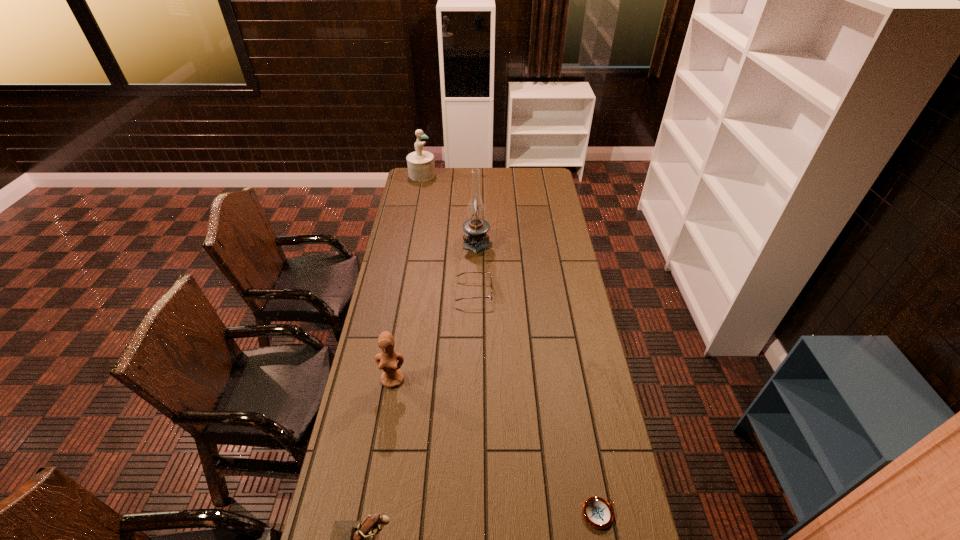
Locate an element on the screen. vacant space located at the beak of the farthest object is located at coordinates (468, 174).

Locate an element on the screen. This screenshot has height=540, width=960. blank space located on the front-facing side of the second farthest figurine is located at coordinates (387, 417).

Image resolution: width=960 pixels, height=540 pixels. In order to click on vacant space situated on the front-facing side of the fifth tallest object in this screenshot , I will do `click(537, 292)`.

I want to click on blank area located on the left of the rightmost object, so click(x=446, y=514).

Locate an element on the screen. This screenshot has width=960, height=540. object present at the far edge is located at coordinates (421, 167).

In order to click on object that is at the right edge in this screenshot , I will do `click(598, 513)`.

Image resolution: width=960 pixels, height=540 pixels. In order to click on object positioned at the far left corner in this screenshot , I will do pos(421,167).

Where is `free region at the far edge of the desktop`? The height and width of the screenshot is (540, 960). free region at the far edge of the desktop is located at coordinates (524, 179).

Identify the location of vacant space at the left edge. The height and width of the screenshot is (540, 960). click(364, 388).

In order to click on blank space at the right edge in this screenshot , I will do [532, 204].